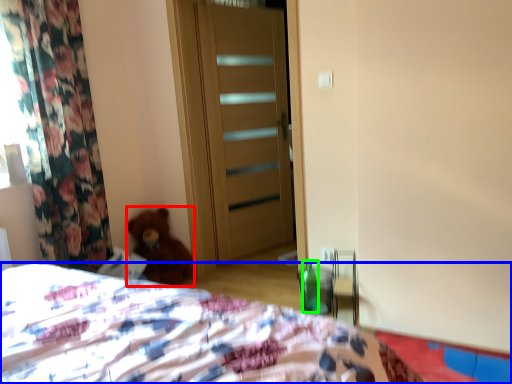
Question: Which object is the farthest from teddy bear (highlighted by a red box)? Choose among these: bed (highlighted by a blue box) or bottle (highlighted by a green box).

Choices:
 (A) bed
 (B) bottle

Answer: (A)